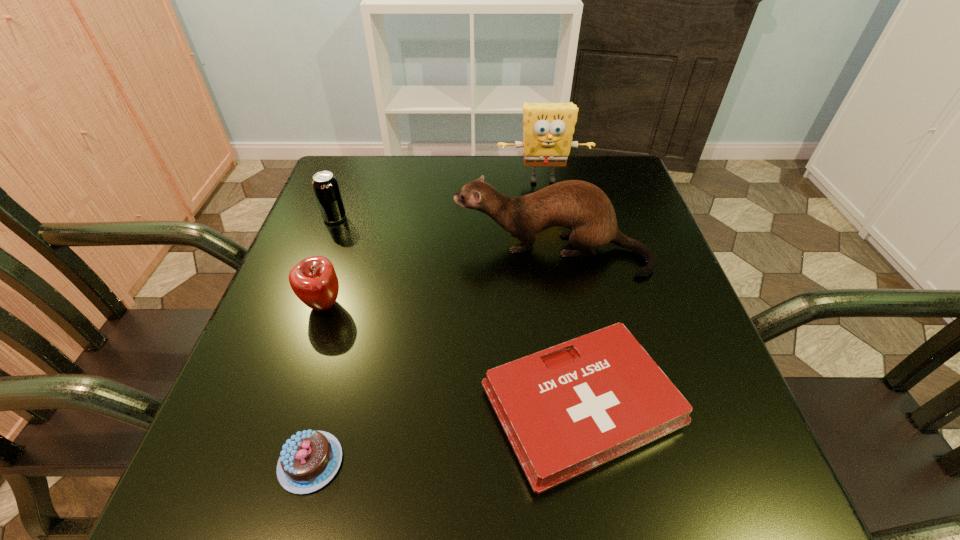
Locate an element on the screen. The height and width of the screenshot is (540, 960). vacant area that lies between the chocolate cake and the ferret is located at coordinates (431, 357).

The height and width of the screenshot is (540, 960). I want to click on free spot between the soda can and the first-aid kit, so [x=458, y=312].

Find the location of `object identified as the fourth closest to the first-aid kit`. object identified as the fourth closest to the first-aid kit is located at coordinates (325, 185).

Identify which object is the nearest to the ferret. Please provide its 2D coordinates. Your answer should be formatted as a tuple, i.e. [(x, y)], where the tuple contains the x and y coordinates of a point satisfying the conditions above.

[(568, 409)]

I want to click on vacant point that satisfies the following two spatial constraints: 1. at the face of the third farthest object; 2. on the front side of the chocolate cake, so click(x=588, y=462).

This screenshot has height=540, width=960. Find the location of `blank space that satisfies the following two spatial constraints: 1. on the face of the farthest object; 2. at the face of the ferret`. blank space that satisfies the following two spatial constraints: 1. on the face of the farthest object; 2. at the face of the ferret is located at coordinates (556, 252).